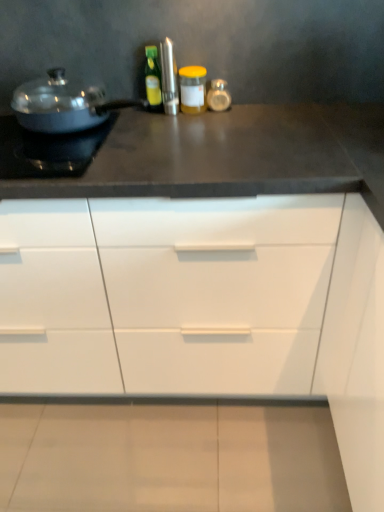
Question: From a real-world perspective, is green glass bottle at center, acting as the 1th bottle starting from the left, physically located above or below white matte cabinet at center?

Choices:
 (A) below
 (B) above

Answer: (B)

Question: Is green glass bottle at center, which is the 2th bottle in right-to-left order, wider or thinner than white matte cabinet at center?

Choices:
 (A) thin
 (B) wide

Answer: (A)

Question: Which is farther from the shiny metallic pot at left?

Choices:
 (A) matte black pan at left
 (B) white matte cabinet at center
 (C) yellow matte jar at center, arranged as the 2th bottle when viewed from the left
 (D) green glass bottle at center, acting as the 1th bottle starting from the left

Answer: (B)

Question: Which is nearer to the yellow matte jar at center, arranged as the 2th bottle when viewed from the left?

Choices:
 (A) white matte cabinet at center
 (B) green glass bottle at center, acting as the 1th bottle starting from the left
 (C) matte black pan at left
 (D) shiny metallic pot at left

Answer: (B)